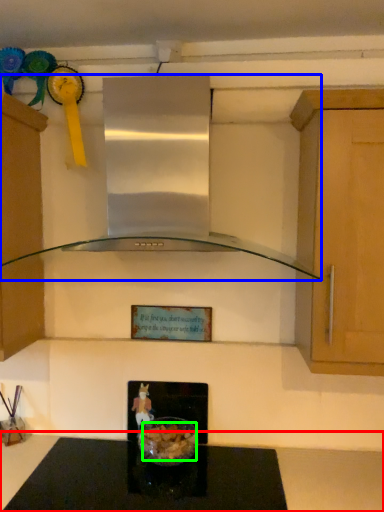
Question: Which object is positioned closest to countertop (highlighted by a red box)? Select from home appliance (highlighted by a blue box) and food (highlighted by a green box).

Choices:
 (A) home appliance
 (B) food

Answer: (B)